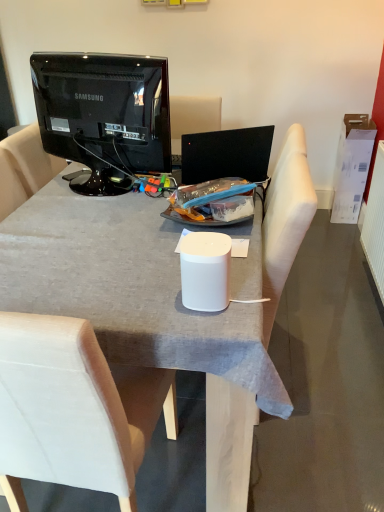
I want to click on free space above white cardboard box at right (from a real-world perspective), so click(x=359, y=122).